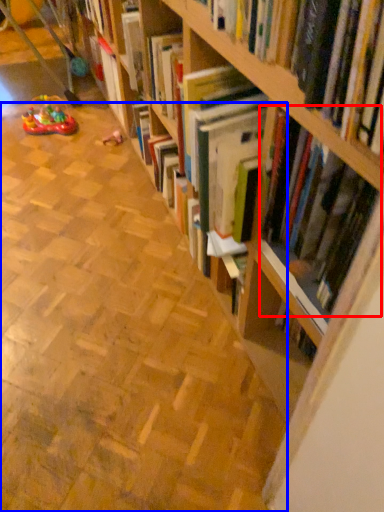
Question: Which object appears farthest to the camera in this image, book (highlighted by a red box) or aisle (highlighted by a blue box)?

Choices:
 (A) book
 (B) aisle

Answer: (B)